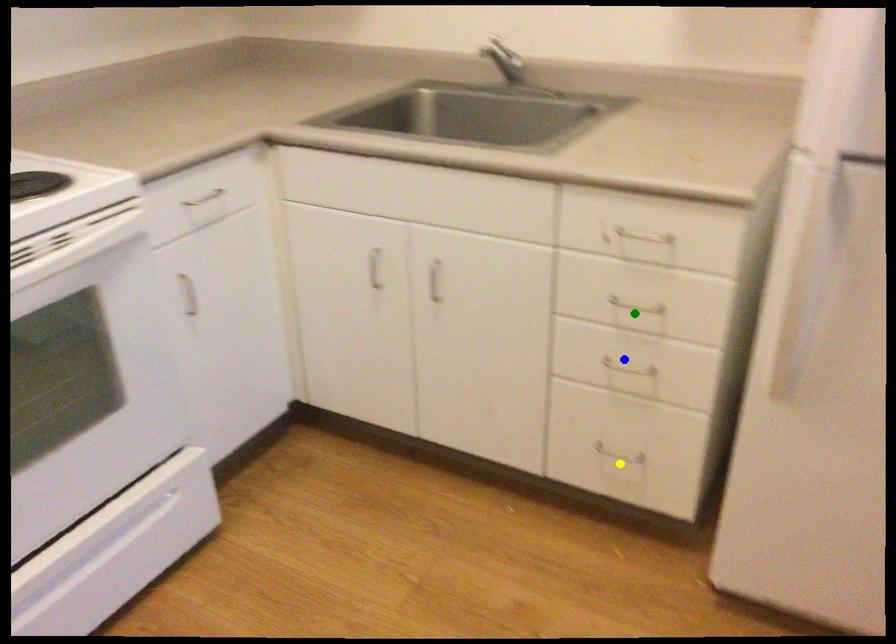
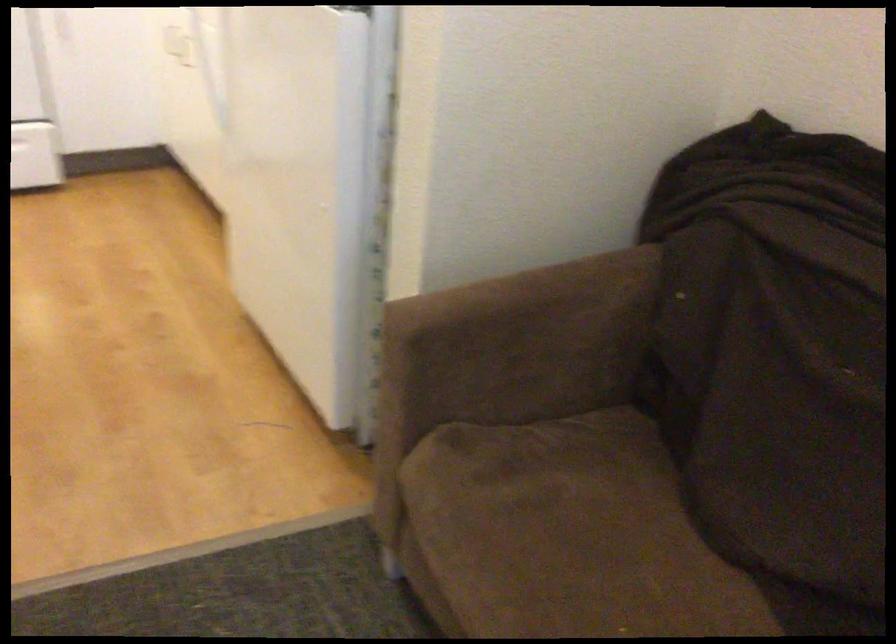
I am providing you with two images of the same scene from different viewpoints. Three points are marked in image1. Which point corresponds to a part or object that is occluded in image2?In image1, three points are marked. Which of them correspond to a part or object that is occluded in image2?Among the three points shown in image1, which one corresponds to a part or object that is no longer visible due to occlusion in image2?

yellow point, green point, blue point